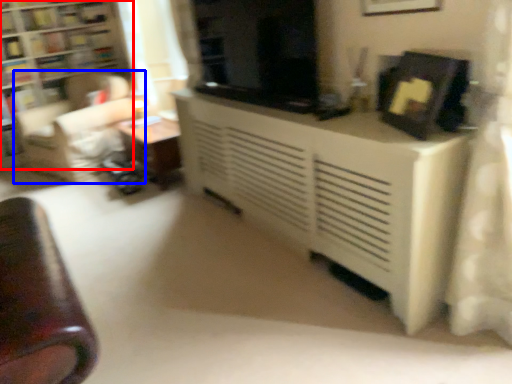
Question: Which object appears closest to the camera in this image, bookcase (highlighted by a red box) or swivel chair (highlighted by a blue box)?

Choices:
 (A) bookcase
 (B) swivel chair

Answer: (B)